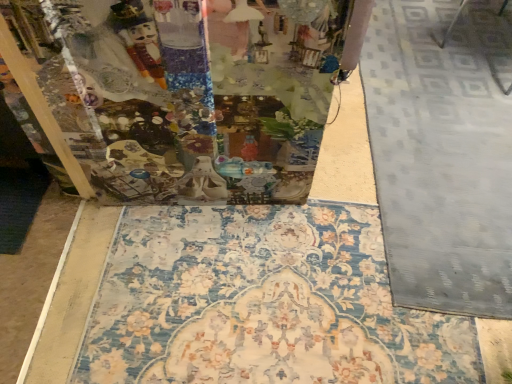
Find the location of `free space above floral carpet at center (from a real-world perspective)`. free space above floral carpet at center (from a real-world perspective) is located at coordinates (281, 280).